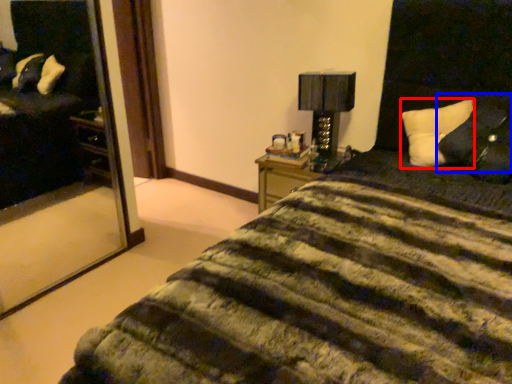
Question: Among these objects, which one is nearest to the camera, pillow (highlighted by a red box) or pillow (highlighted by a blue box)?

Choices:
 (A) pillow
 (B) pillow

Answer: (B)